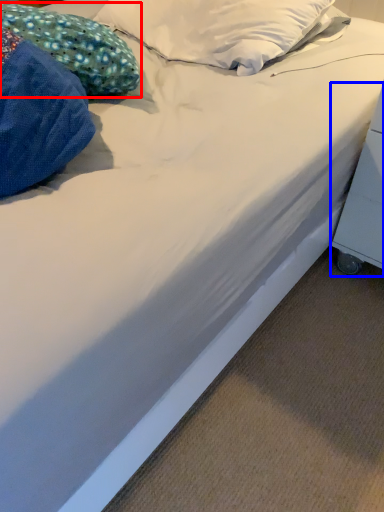
Question: Which point is closer to the camera, pillow (highlighted by a red box) or table (highlighted by a blue box)?

Choices:
 (A) pillow
 (B) table

Answer: (B)